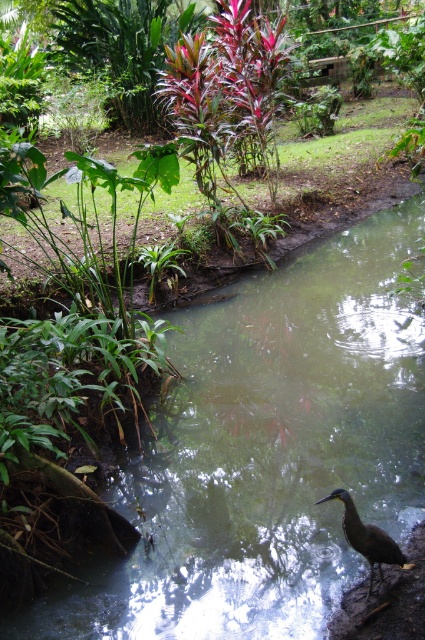
Question: Is greenish murky water at center below brown glossy bird at lower center?

Choices:
 (A) yes
 (B) no

Answer: (A)

Question: Which object appears closest to the camera in this image?

Choices:
 (A) brown glossy bird at lower center
 (B) greenish murky water at center

Answer: (A)

Question: Which of the following is the farthest from the observer?

Choices:
 (A) brown glossy bird at lower center
 (B) greenish murky water at center

Answer: (B)

Question: Can you confirm if greenish murky water at center is bigger than brown glossy bird at lower center?

Choices:
 (A) no
 (B) yes

Answer: (A)

Question: Can you confirm if greenish murky water at center is positioned to the left of brown glossy bird at lower center?

Choices:
 (A) no
 (B) yes

Answer: (B)